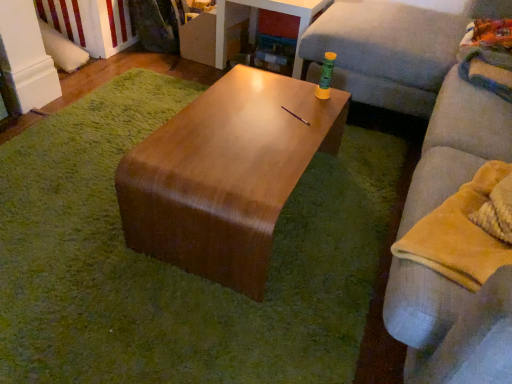
This screenshot has height=384, width=512. I want to click on free space in front of shiny brown coffee table at center, so click(211, 312).